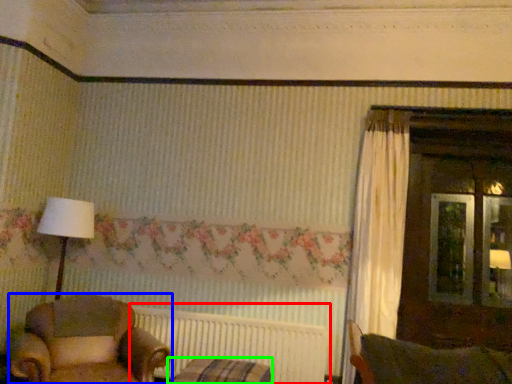
Question: Considering the real-world distances, which object is farthest from radiator (highlighted by a red box)? chair (highlighted by a blue box) or furniture (highlighted by a green box)?

Choices:
 (A) chair
 (B) furniture

Answer: (A)